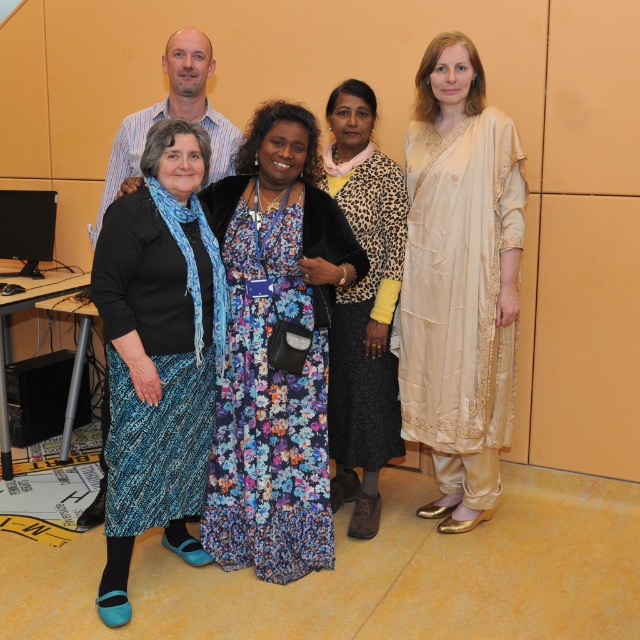
In the image, there are two women wearing blue and a man. Where is the floral dress at center located in terms of coordinates?

The floral dress at center is located at coordinates point (268, 349).

You are standing in the room and want to hand a gift to the person wearing the floral dress at center and the person wearing the cream satin kurta at right. Which one can you reach without moving closer?

The floral dress at center is closer to the viewer than the cream satin kurta at right, so you can reach the person wearing the floral dress at center without moving closer.

You are organizing a photoshoot and need to arrange the floral dress at center and the leopard print jacket at center side by side on a mannequin. Based on their sizes, which one should be placed first to ensure they fit properly?

The leopard print jacket at center should be placed first since it is narrower than the floral dress at center, allowing enough space for both items on the mannequin.